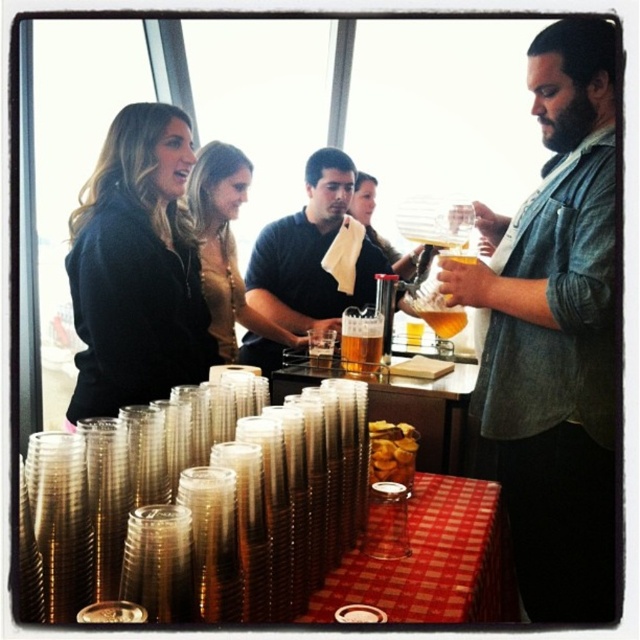
Between red checkered tablecloth at lower center and matte gold necklace at upper center, which one is positioned lower?

red checkered tablecloth at lower center is below.

Does red checkered tablecloth at lower center appear over matte gold necklace at upper center?

No, red checkered tablecloth at lower center is not above matte gold necklace at upper center.

Image resolution: width=640 pixels, height=640 pixels. What are the coordinates of `red checkered tablecloth at lower center` in the screenshot? It's located at (433, 561).

This screenshot has height=640, width=640. Identify the location of red checkered tablecloth at lower center. (433, 561).

Is translucent plastic cup at center positioned at the back of translucent glass carafe at center?

Yes, translucent plastic cup at center is further from the viewer.

What do you see at coordinates (360, 342) in the screenshot? The height and width of the screenshot is (640, 640). I see `translucent plastic cup at center` at bounding box center [360, 342].

Where is `translucent plastic cup at center`? translucent plastic cup at center is located at coordinates (360, 342).

Can you confirm if matte gold necklace at upper center is smaller than translucent plastic cup at center?

No, matte gold necklace at upper center is not smaller than translucent plastic cup at center.

Describe the element at coordinates (225, 246) in the screenshot. I see `matte gold necklace at upper center` at that location.

The width and height of the screenshot is (640, 640). Identify the location of matte gold necklace at upper center. (225, 246).